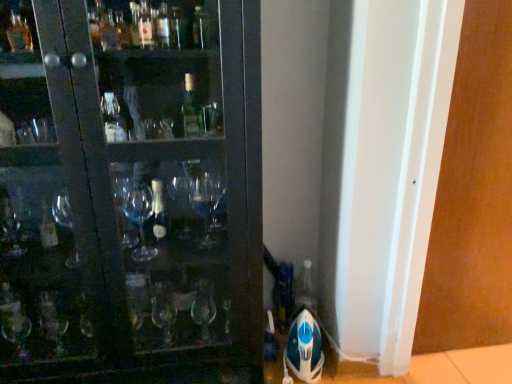
Question: Can you confirm if white glossy screen door at right, marked as the first screen door in a left-to-right arrangement, is thinner than brown matte screen door at right, arranged as the 1th screen door when viewed from the right?

Choices:
 (A) no
 (B) yes

Answer: (B)

Question: Is white glossy screen door at right, marked as the first screen door in a left-to-right arrangement, bigger than brown matte screen door at right, arranged as the second screen door when viewed from the left?

Choices:
 (A) no
 (B) yes

Answer: (B)

Question: Is white glossy screen door at right, marked as the first screen door in a left-to-right arrangement, behind brown matte screen door at right, arranged as the 1th screen door when viewed from the right?

Choices:
 (A) yes
 (B) no

Answer: (B)

Question: Is the depth of white glossy screen door at right, marked as the first screen door in a left-to-right arrangement, less than that of brown matte screen door at right, arranged as the 1th screen door when viewed from the right?

Choices:
 (A) no
 (B) yes

Answer: (B)

Question: Is white glossy screen door at right, marked as the first screen door in a left-to-right arrangement, to the right of brown matte screen door at right, arranged as the 1th screen door when viewed from the right, from the viewer's perspective?

Choices:
 (A) no
 (B) yes

Answer: (A)

Question: Considering the relative sizes of white glossy screen door at right, marked as the first screen door in a left-to-right arrangement, and brown matte screen door at right, arranged as the second screen door when viewed from the left, in the image provided, is white glossy screen door at right, marked as the first screen door in a left-to-right arrangement, smaller than brown matte screen door at right, arranged as the second screen door when viewed from the left,?

Choices:
 (A) yes
 (B) no

Answer: (B)

Question: Is brown matte screen door at right, arranged as the second screen door when viewed from the left, wider than white glossy screen door at right, positioned as the 2th screen door in right-to-left order?

Choices:
 (A) no
 (B) yes

Answer: (B)

Question: Is brown matte screen door at right, arranged as the second screen door when viewed from the left, smaller than white glossy screen door at right, positioned as the 2th screen door in right-to-left order?

Choices:
 (A) yes
 (B) no

Answer: (A)

Question: Is brown matte screen door at right, arranged as the second screen door when viewed from the left, not near white glossy screen door at right, positioned as the 2th screen door in right-to-left order?

Choices:
 (A) yes
 (B) no

Answer: (B)

Question: Is brown matte screen door at right, arranged as the 1th screen door when viewed from the right, taller than white glossy screen door at right, marked as the first screen door in a left-to-right arrangement?

Choices:
 (A) yes
 (B) no

Answer: (A)

Question: Is brown matte screen door at right, arranged as the second screen door when viewed from the left, at the right side of white glossy screen door at right, positioned as the 2th screen door in right-to-left order?

Choices:
 (A) no
 (B) yes

Answer: (B)

Question: From a real-world perspective, is brown matte screen door at right, arranged as the 1th screen door when viewed from the right, positioned over white glossy screen door at right, positioned as the 2th screen door in right-to-left order, based on gravity?

Choices:
 (A) yes
 (B) no

Answer: (A)

Question: In the image, is brown matte screen door at right, arranged as the 1th screen door when viewed from the right, on the left side or the right side of white glossy screen door at right, marked as the first screen door in a left-to-right arrangement?

Choices:
 (A) right
 (B) left

Answer: (A)